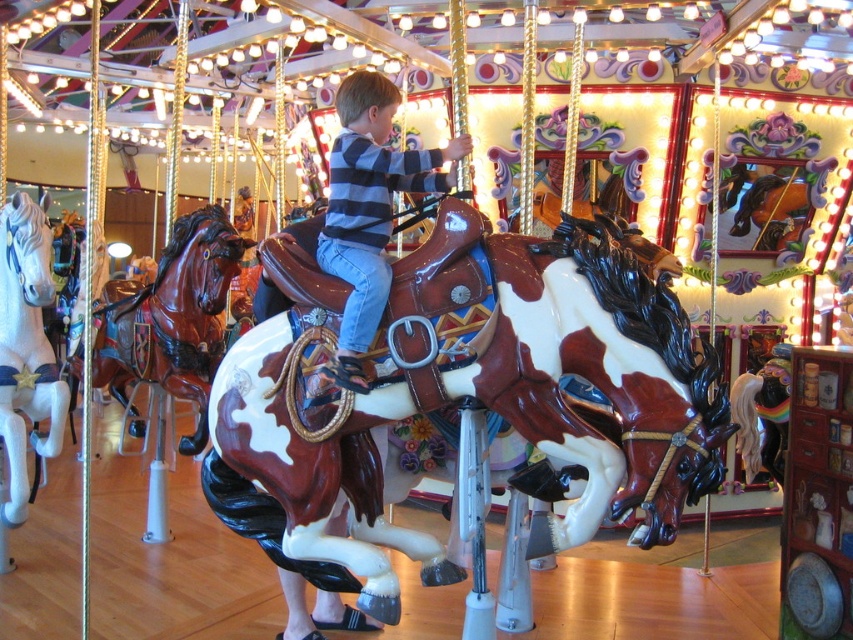
Between brown glossy horse at center and white glossy horse at left, which one appears on the right side from the viewer's perspective?

From the viewer's perspective, brown glossy horse at center appears more on the right side.

Is brown glossy horse at center below white glossy horse at left?

Yes, brown glossy horse at center is below white glossy horse at left.

Is point (529, 356) behind point (67, 385)?

No, it is not.

This screenshot has height=640, width=853. In order to click on brown glossy horse at center in this screenshot , I will do `click(480, 385)`.

Does brown glossy horse at left have a smaller size compared to white glossy horse at left?

Incorrect, brown glossy horse at left is not smaller in size than white glossy horse at left.

Does point (154, 317) lie behind point (50, 365)?

That is True.

At what (x,y) coordinates should I click in order to perform the action: click on brown glossy horse at left. Please return your answer as a coordinate pair (x, y). The width and height of the screenshot is (853, 640). Looking at the image, I should click on (173, 317).

Between point (376, 246) and point (99, 321), which one is positioned behind?

Positioned behind is point (99, 321).

Between striped cotton shirt at center and brown glossy horse at left, which one has less height?

Standing shorter between the two is striped cotton shirt at center.

Is point (396, 179) closer to viewer compared to point (184, 259)?

That is True.

Locate an element on the screen. The height and width of the screenshot is (640, 853). striped cotton shirt at center is located at coordinates (369, 209).